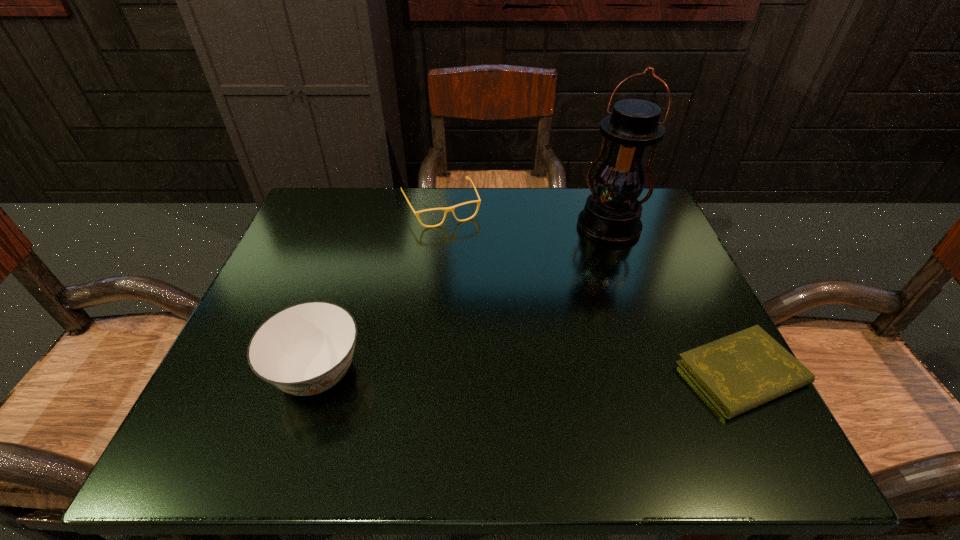
Where is `free location that satisfies the following two spatial constraints: 1. on the back side of the soup bowl; 2. on the left side of the lantern`? This screenshot has height=540, width=960. free location that satisfies the following two spatial constraints: 1. on the back side of the soup bowl; 2. on the left side of the lantern is located at coordinates (364, 227).

The image size is (960, 540). Find the location of `free space that satisfies the following two spatial constraints: 1. on the front side of the second tallest object; 2. on the right side of the shortest object`. free space that satisfies the following two spatial constraints: 1. on the front side of the second tallest object; 2. on the right side of the shortest object is located at coordinates (318, 374).

Where is `free space that satisfies the following two spatial constraints: 1. on the front side of the third tallest object; 2. on the left side of the shortest object`? free space that satisfies the following two spatial constraints: 1. on the front side of the third tallest object; 2. on the left side of the shortest object is located at coordinates tap(421, 374).